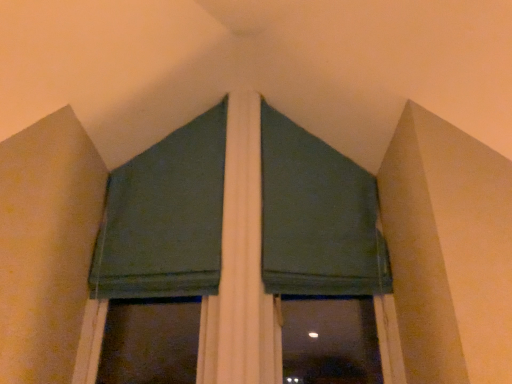
Question: Is dark green fabric at upper center, the second curtain from the right, smaller than dark green fabric at upper center, the 2th curtain in the left-to-right sequence?

Choices:
 (A) no
 (B) yes

Answer: (B)

Question: Is dark green fabric at upper center, marked as the first curtain in a left-to-right arrangement, facing towards dark green fabric at upper center, the 2th curtain in the left-to-right sequence?

Choices:
 (A) yes
 (B) no

Answer: (B)

Question: Is dark green fabric at upper center, marked as the first curtain in a left-to-right arrangement, directly adjacent to dark green fabric at upper center, placed as the first curtain when sorted from right to left?

Choices:
 (A) no
 (B) yes

Answer: (A)

Question: Are dark green fabric at upper center, marked as the first curtain in a left-to-right arrangement, and dark green fabric at upper center, placed as the first curtain when sorted from right to left, far apart?

Choices:
 (A) yes
 (B) no

Answer: (B)

Question: Does dark green fabric at upper center, marked as the first curtain in a left-to-right arrangement, have a lesser height compared to dark green fabric at upper center, placed as the first curtain when sorted from right to left?

Choices:
 (A) yes
 (B) no

Answer: (B)

Question: Is dark green fabric at center wider or thinner than dark green fabric at upper center, marked as the first curtain in a left-to-right arrangement?

Choices:
 (A) wide
 (B) thin

Answer: (A)

Question: Relative to dark green fabric at upper center, marked as the first curtain in a left-to-right arrangement, is dark green fabric at center in front or behind?

Choices:
 (A) behind
 (B) front

Answer: (B)

Question: Considering the positions of dark green fabric at center and dark green fabric at upper center, the second curtain from the right, in the image, is dark green fabric at center taller or shorter than dark green fabric at upper center, the second curtain from the right,?

Choices:
 (A) tall
 (B) short

Answer: (A)

Question: Is dark green fabric at center spatially inside dark green fabric at upper center, the second curtain from the right, or outside of it?

Choices:
 (A) outside
 (B) inside

Answer: (A)

Question: Looking at the image, does dark green fabric at upper center, placed as the first curtain when sorted from right to left, seem bigger or smaller compared to dark green fabric at upper center, the second curtain from the right?

Choices:
 (A) big
 (B) small

Answer: (A)

Question: Does point (322, 266) appear closer or farther from the camera than point (130, 198)?

Choices:
 (A) closer
 (B) farther

Answer: (A)

Question: From the image's perspective, is dark green fabric at upper center, the 2th curtain in the left-to-right sequence, above or below dark green fabric at upper center, the second curtain from the right?

Choices:
 (A) above
 (B) below

Answer: (B)

Question: Relative to dark green fabric at upper center, marked as the first curtain in a left-to-right arrangement, is dark green fabric at upper center, placed as the first curtain when sorted from right to left, in front or behind?

Choices:
 (A) behind
 (B) front

Answer: (A)

Question: In the image, is dark green fabric at upper center, placed as the first curtain when sorted from right to left, positioned in front of or behind dark green fabric at center?

Choices:
 (A) behind
 (B) front

Answer: (A)

Question: From the image's perspective, is dark green fabric at upper center, the 2th curtain in the left-to-right sequence, positioned above or below dark green fabric at center?

Choices:
 (A) below
 (B) above

Answer: (B)